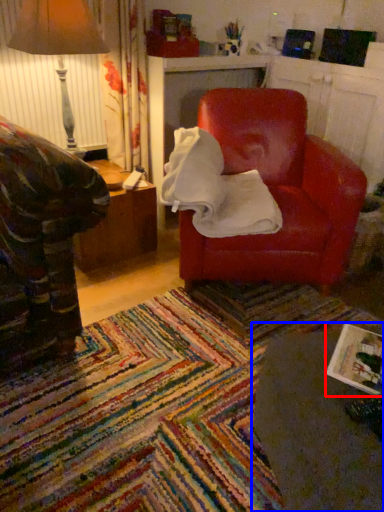
Question: Which point is further to the camera, magazine (highlighted by a red box) or table (highlighted by a blue box)?

Choices:
 (A) magazine
 (B) table

Answer: (A)